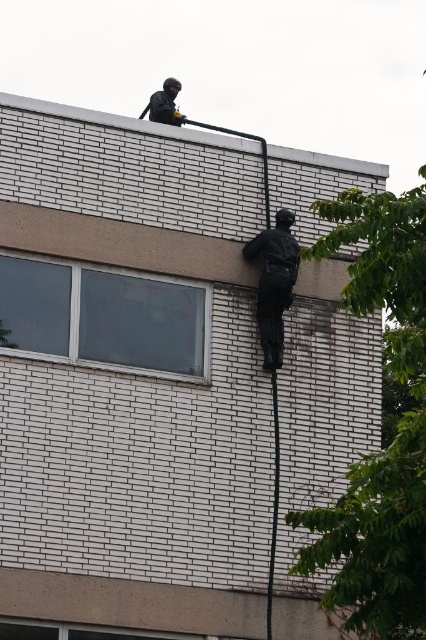
You are a construction worker standing at the base of the building depicted in the image. You need to reach a specific point marked at coordinates point (141, 340) on the building facade. Given that the distance from your current position to this point is 59.44 meters, can you safely climb up the building to reach it using standard safety equipment?

The distance to point (141, 340) is 59.44 meters. Standard safety equipment for climbing typically has limits, but without knowing the maximum safe climbing height or equipment specifications, it is impossible to determine safety. Consult equipment guidelines or a supervisor for clearance.

You are a safety inspector assessing the scene. The clear glass window at lower left and the matte black figure at center are both in your line of sight. Which object is taller?

The matte black figure at center is taller than the clear glass window at lower left.

You are standing in front of the building and looking at the two points marked in the image. Which point, point (336, 186) or point (169, 93), is closer to you?

Point (336, 186) is closer to you than point (169, 93).